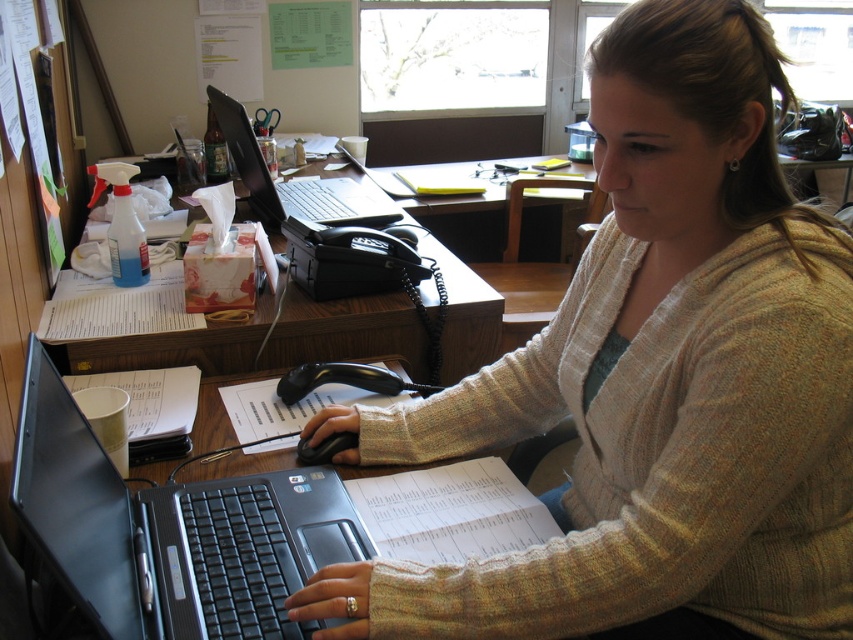
You are a delivery person who needs to place a package on the desk. The package is 1 meter long. Can you fit it on the woodendesk at center without overlapping the matte black laptop at center?

The woodendesk at center is in front of the matte black laptop at center, but the exact dimensions of the desk and the distance between them are not provided. Therefore, it is uncertain if the 1 meter long package can fit without overlapping the laptop.

You are a drone operator trying to deliver a small package to a specific location on the desk. The delivery point is at point [746,404]. However, there is an obstacle at point [140,552]. Can you safely drop the package at the delivery point without hitting the obstacle?

Point [746,404] is closer to the camera than point [140,552], so the drone can safely drop the package at the delivery point as it is nearer and the obstacle is further away.